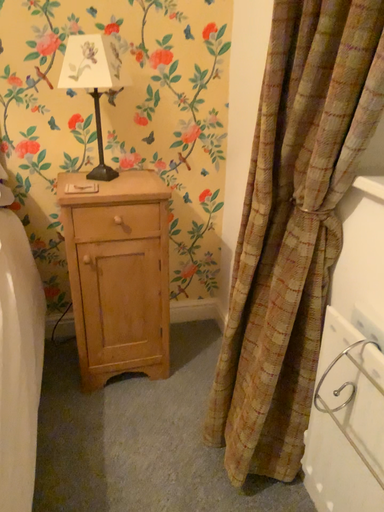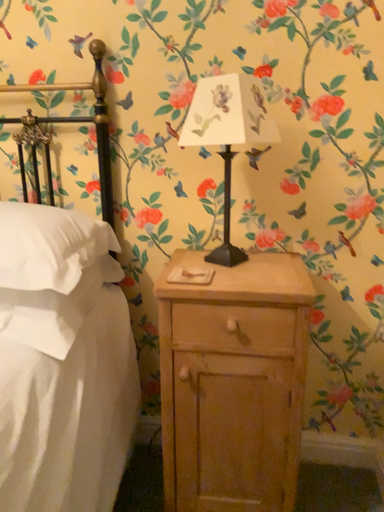
Question: How did the camera likely rotate when shooting the video?

Choices:
 (A) rotated left
 (B) rotated right

Answer: (A)